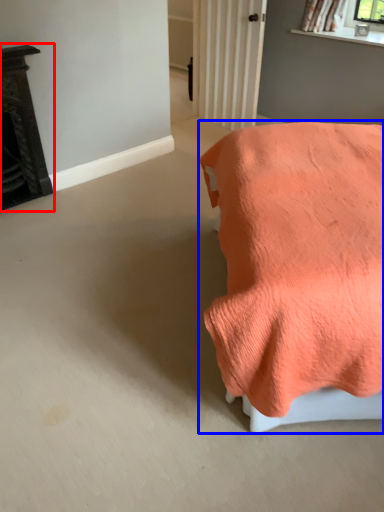
Question: Which object is closer to the camera taking this photo, furniture (highlighted by a red box) or furniture (highlighted by a blue box)?

Choices:
 (A) furniture
 (B) furniture

Answer: (B)